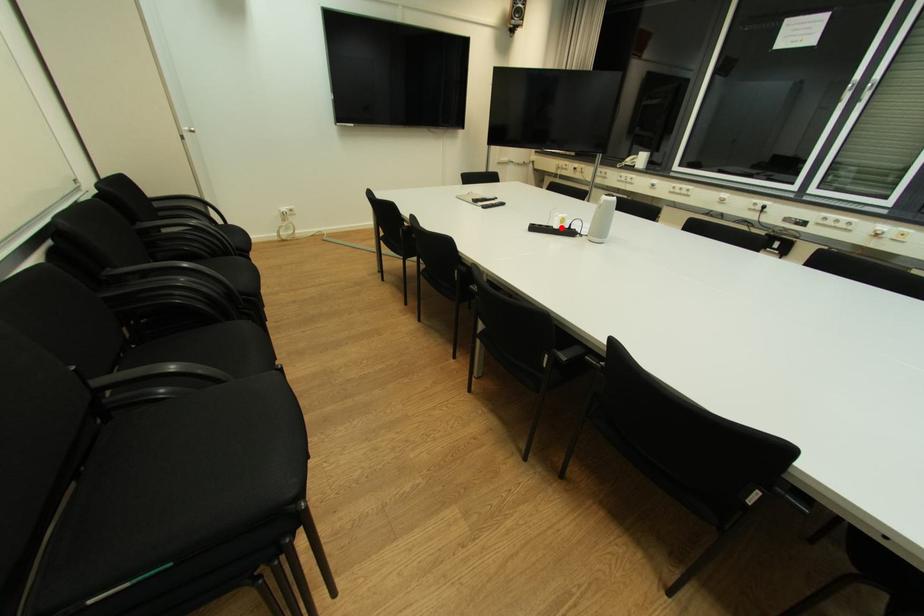
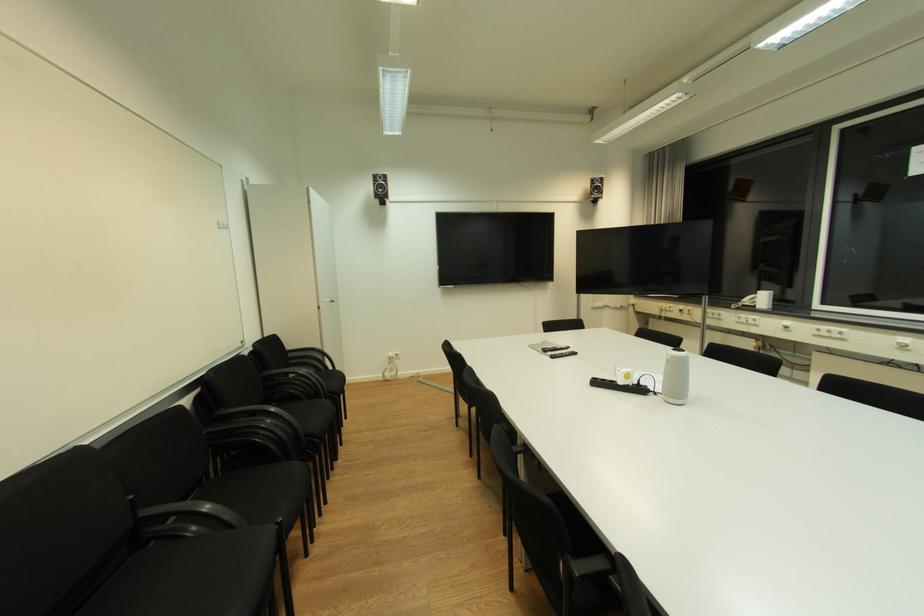
Where in the second image is the point corresponding to the highlighted location from the first image?

(626, 384)